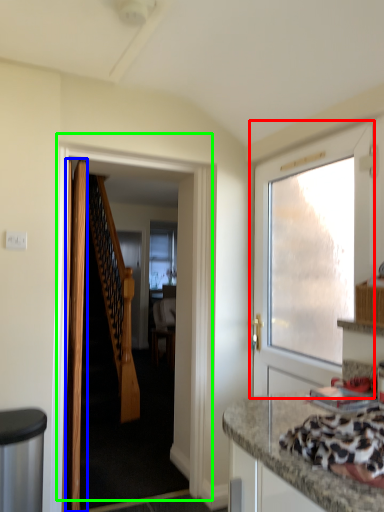
Question: Which is nearer to the door (highlighted by a red box)? door (highlighted by a blue box) or door (highlighted by a green box).

Choices:
 (A) door
 (B) door

Answer: (B)